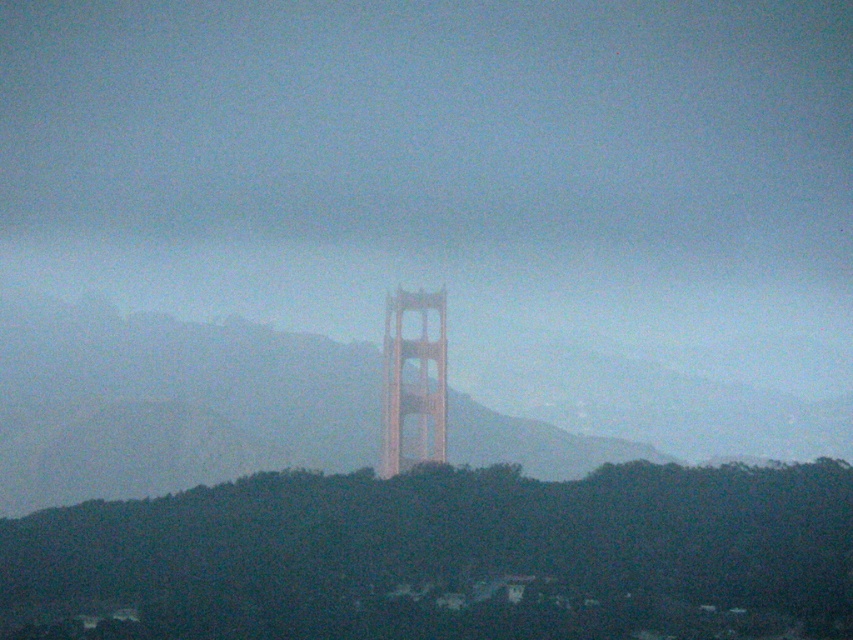
Is point (770, 570) positioned in front of point (424, 340)?

No, it is behind (424, 340).

Describe the element at coordinates (445, 556) in the screenshot. The height and width of the screenshot is (640, 853). I see `dark green foliage at center` at that location.

The image size is (853, 640). In order to click on dark green foliage at center in this screenshot , I will do `click(445, 556)`.

Image resolution: width=853 pixels, height=640 pixels. In order to click on dark green foliage at center in this screenshot , I will do `click(445, 556)`.